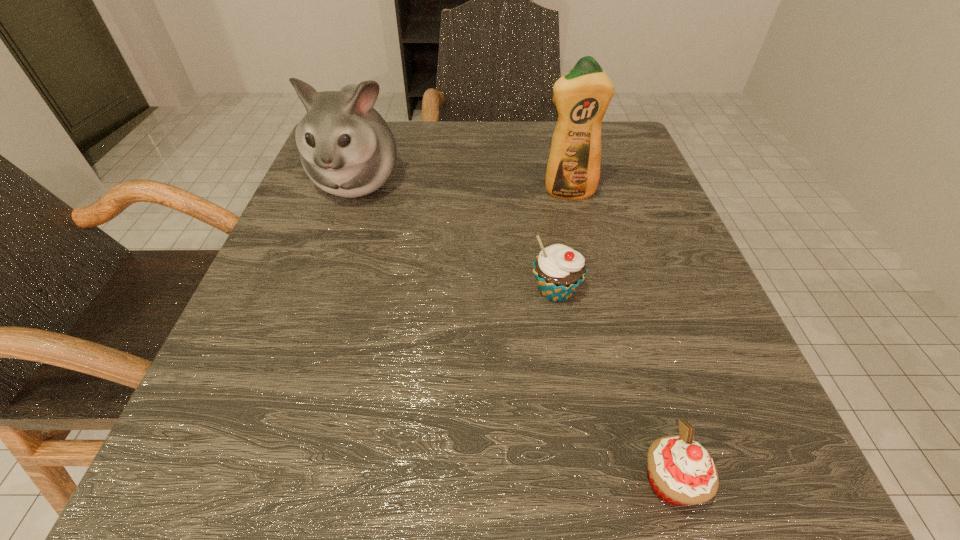
Where is `detergent`? detergent is located at coordinates (582, 96).

Where is `the second tallest object`? The image size is (960, 540). the second tallest object is located at coordinates (347, 149).

Find the location of a particular element. The image size is (960, 540). hamster is located at coordinates (347, 149).

The image size is (960, 540). I want to click on the second nearest object, so click(559, 270).

The width and height of the screenshot is (960, 540). I want to click on the taller cupcake, so click(559, 270).

Where is `the right cupcake`? The height and width of the screenshot is (540, 960). the right cupcake is located at coordinates (681, 472).

I want to click on the shorter cupcake, so click(x=681, y=472).

Image resolution: width=960 pixels, height=540 pixels. I want to click on vacant position located on the label of the detergent, so click(574, 219).

The width and height of the screenshot is (960, 540). In order to click on vacant space situated on the face of the hamster in this screenshot , I will do `click(318, 296)`.

Where is `vacant space situated 0.380m on the left of the left cupcake`? This screenshot has width=960, height=540. vacant space situated 0.380m on the left of the left cupcake is located at coordinates (276, 292).